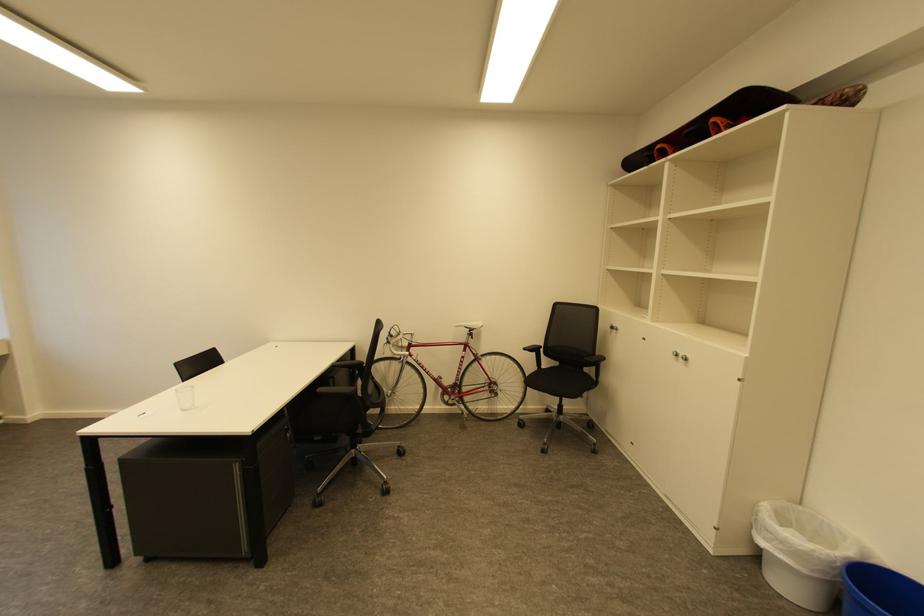
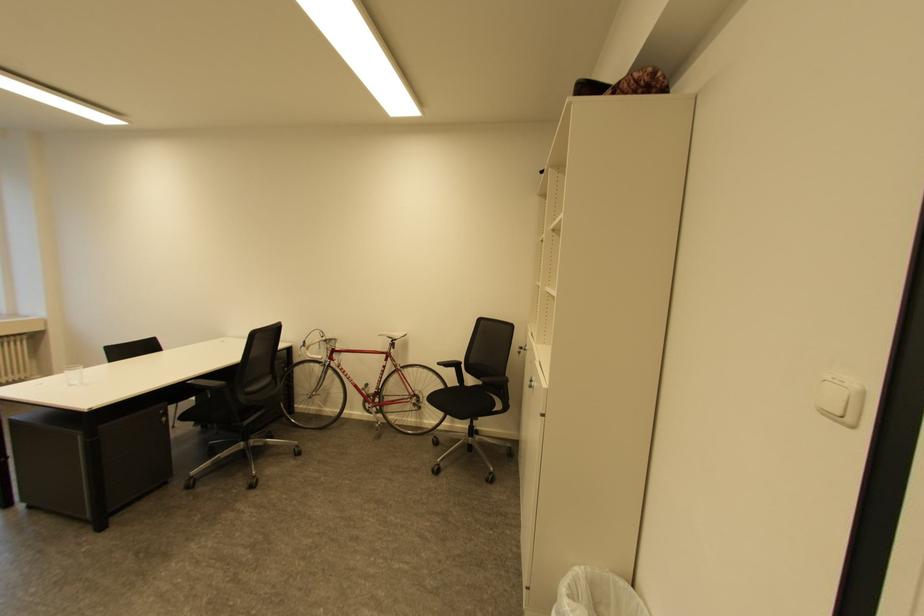
Where in the second image is the point corresponding to (x=769, y=504) from the first image?

(579, 569)